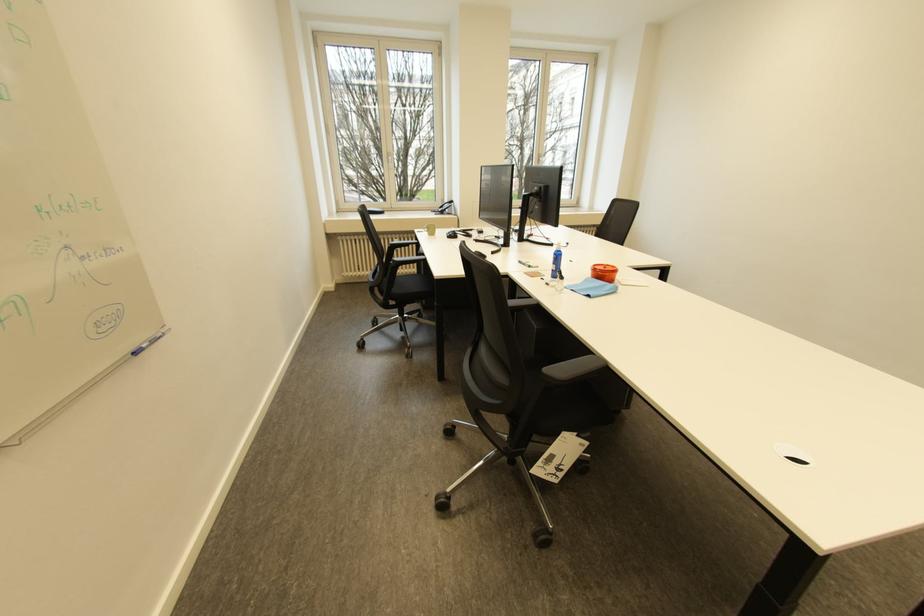
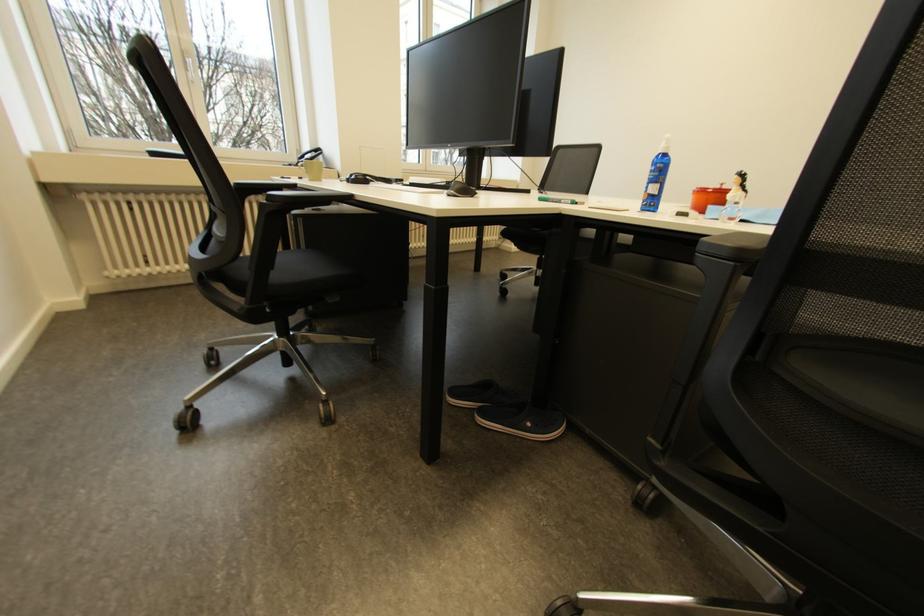
In a continuous first-person perspective shot, in which direction is the camera moving?

The movement direction of the cameraman is left, forward.